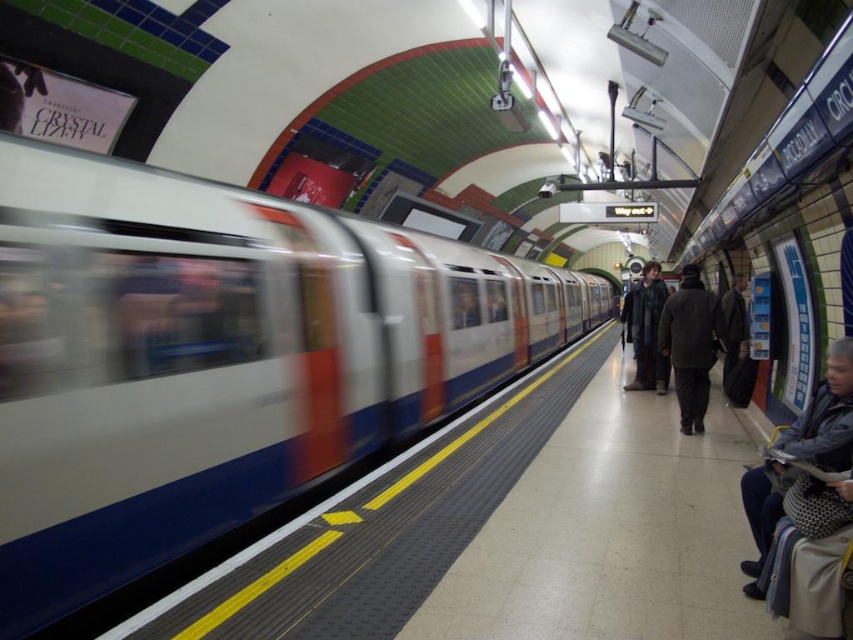
Question: Can you confirm if dark gray fabric jacket at lower right is positioned to the left of dark gray coat at center?

Choices:
 (A) yes
 (B) no

Answer: (A)

Question: Which point appears closest to the camera in this image?

Choices:
 (A) (486, 353)
 (B) (692, 424)
 (C) (733, 326)

Answer: (B)

Question: Does dark brown wool coat at center come behind dark gray coat at center?

Choices:
 (A) no
 (B) yes

Answer: (A)

Question: Which object is positioned farthest from the dark brown wool coat at center?

Choices:
 (A) dark gray jacket at right
 (B) dark gray fabric jacket at lower right
 (C) metallic silver train at left

Answer: (C)

Question: In this image, where is dark gray coat at center located relative to dark gray jacket at right?

Choices:
 (A) right
 (B) left

Answer: (B)

Question: Which of the following is the closest to the observer?

Choices:
 (A) metallic silver train at left
 (B) dark brown wool coat at center
 (C) dark gray fabric jacket at lower right
 (D) dark gray coat at center

Answer: (A)